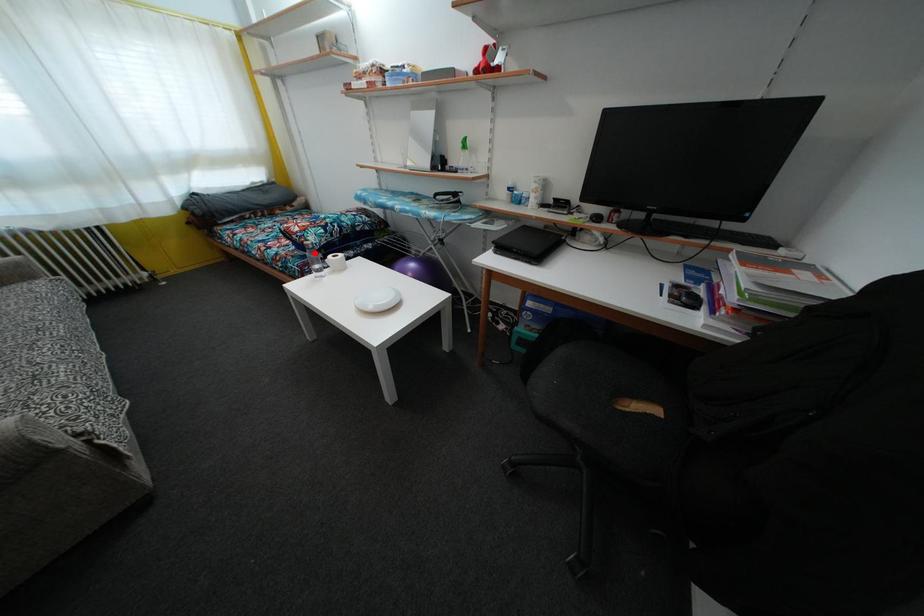
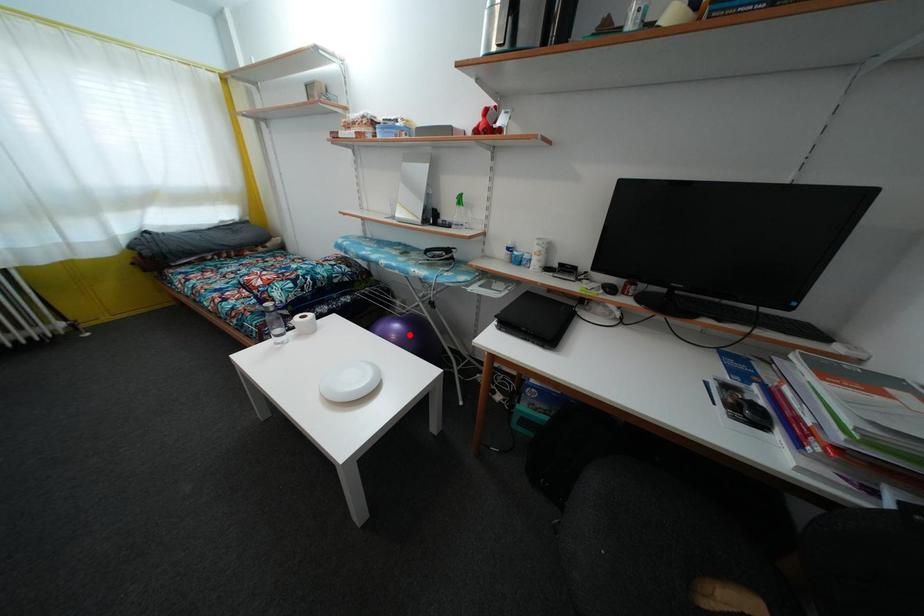
I am providing you with two images of the same scene from different viewpoints. A red point is marked on the first image and another point is marked on the second image. Do the highlighted points in image1 and image2 indicate the same real-world spot?

No